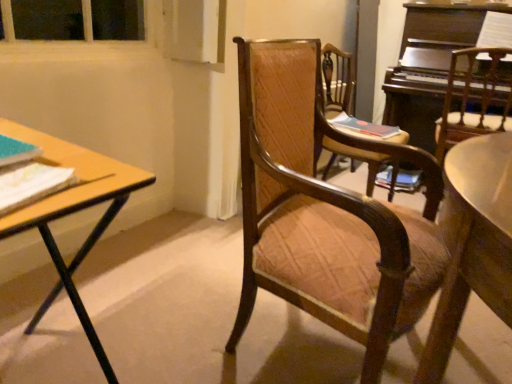
Question: Should I look upward or downward to see wooden desk at left?

Choices:
 (A) up
 (B) down

Answer: (B)

Question: Could you tell me if wooden chair at center, acting as the 3th chair starting from the left, is turned towards wooden desk at left?

Choices:
 (A) no
 (B) yes

Answer: (A)

Question: Considering the relative sizes of wooden chair at center, acting as the first chair starting from the right, and wooden desk at left in the image provided, is wooden chair at center, acting as the first chair starting from the right, thinner than wooden desk at left?

Choices:
 (A) no
 (B) yes

Answer: (B)

Question: Considering the relative sizes of wooden chair at center, acting as the 3th chair starting from the left, and wooden desk at left in the image provided, is wooden chair at center, acting as the 3th chair starting from the left, wider than wooden desk at left?

Choices:
 (A) yes
 (B) no

Answer: (B)

Question: Is wooden chair at center, acting as the 3th chair starting from the left, located outside wooden desk at left?

Choices:
 (A) yes
 (B) no

Answer: (A)

Question: Does wooden chair at center, acting as the first chair starting from the right, have a lesser height compared to wooden desk at left?

Choices:
 (A) no
 (B) yes

Answer: (A)

Question: Considering the relative sizes of wooden chair at center, acting as the first chair starting from the right, and wooden desk at left in the image provided, is wooden chair at center, acting as the first chair starting from the right, smaller than wooden desk at left?

Choices:
 (A) yes
 (B) no

Answer: (B)

Question: Is wooden textured chair at center, which appears as the second chair when viewed from the right, next to matte pink book at center, which is the third book from bottom to top?

Choices:
 (A) yes
 (B) no

Answer: (B)

Question: Is wooden textured chair at center, which appears as the second chair when viewed from the right, oriented towards matte pink book at center, acting as the first book starting from the top?

Choices:
 (A) yes
 (B) no

Answer: (A)

Question: Can you confirm if wooden textured chair at center, which is counted as the second chair, starting from the left, is taller than matte pink book at center, the first book viewed from the back?

Choices:
 (A) yes
 (B) no

Answer: (A)

Question: Is the depth of wooden textured chair at center, which appears as the second chair when viewed from the right, less than that of matte pink book at center, the first book from the right?

Choices:
 (A) yes
 (B) no

Answer: (A)

Question: Does wooden textured chair at center, which appears as the second chair when viewed from the right, appear on the left side of matte pink book at center, the first book from the right?

Choices:
 (A) no
 (B) yes

Answer: (B)

Question: From the image's perspective, is wooden textured chair at center, which is counted as the second chair, starting from the left, located beneath matte pink book at center, arranged as the 3th book when viewed from the left?

Choices:
 (A) yes
 (B) no

Answer: (A)

Question: From the image's perspective, is matte blue book at left, which appears as the second book when viewed from the top, on top of wooden textured chair at center, which is counted as the second chair, starting from the left?

Choices:
 (A) no
 (B) yes

Answer: (A)